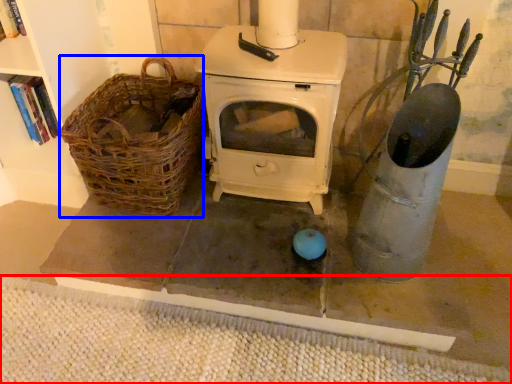
Question: Among these objects, which one is farthest to the camera, mat (highlighted by a red box) or basket (highlighted by a blue box)?

Choices:
 (A) mat
 (B) basket

Answer: (B)